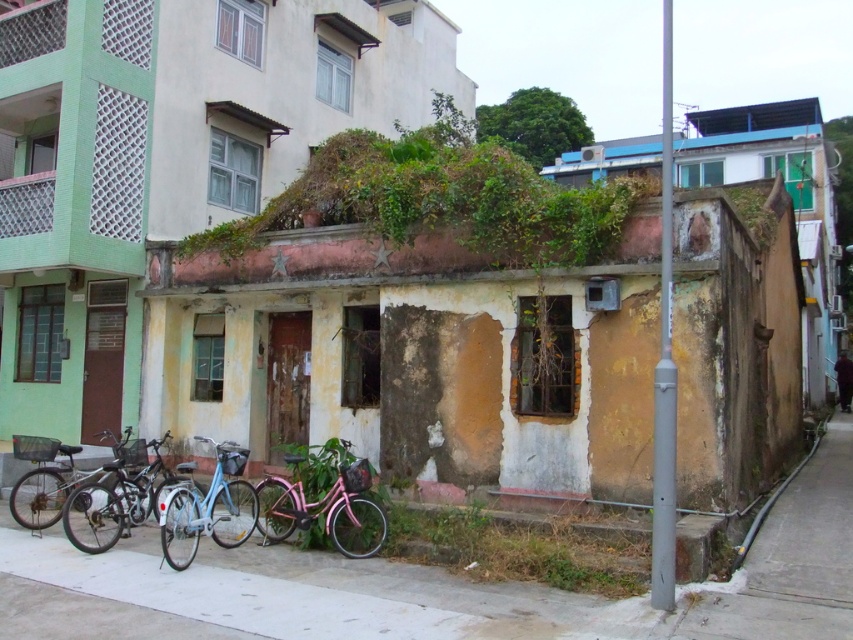
You are standing at the edge of the scene and want to walk towards the concrete pavement at lower center. Will you pass by the brushed metal bicycle at lower left before reaching it?

The concrete pavement at lower center is closer to the viewer than the brushed metal bicycle at lower left, so you will reach the concrete pavement at lower center before passing the brushed metal bicycle at lower left. Therefore, you will not pass by the brushed metal bicycle at lower left before reaching the concrete pavement at lower center.

You are a delivery person who needs to choose between the pink matte bicycle at center and the metallic silver bicycle at lower left. Which bicycle is taller?

The pink matte bicycle at center is taller than the metallic silver bicycle at lower left.